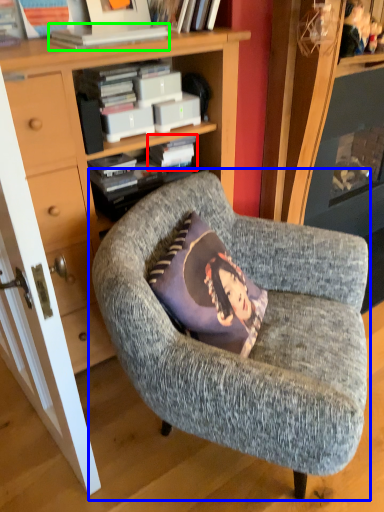
Question: Estimate the real-world distances between objects in this image. Which object is closer to paperback book (highlighted by a red box), chair (highlighted by a blue box) or book (highlighted by a green box)?

Choices:
 (A) chair
 (B) book

Answer: (B)